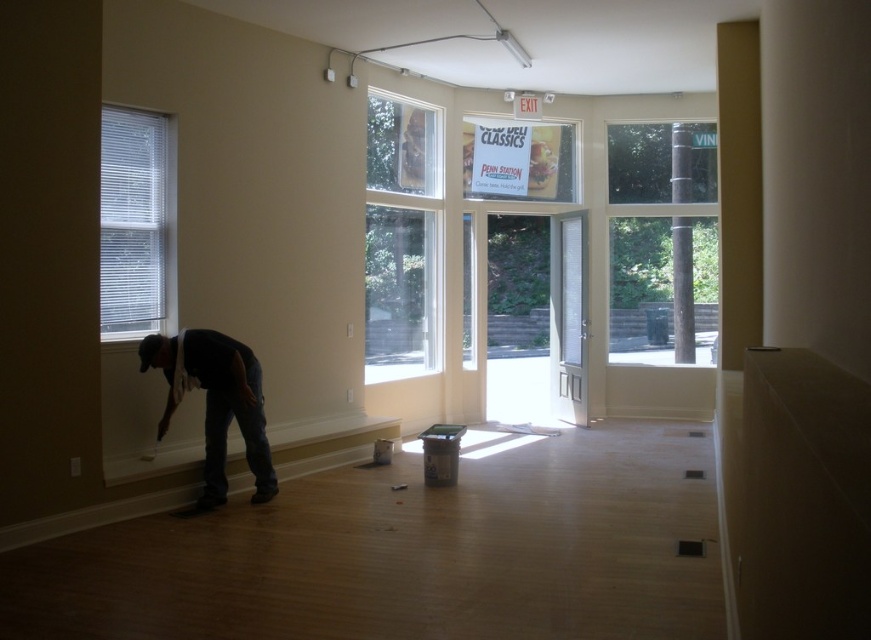
You are an interior designer who wants to install a new decorative sticker on the clear glass window at center and the white blinds at left. Since you want the stickers to be proportional to the objects, which object should you choose a larger sticker for?

The clear glass window at center is bigger than the white blinds at left, so you should choose a larger sticker for the clear glass window at center.

You are standing in the room and want to exit through the clear glass door at center. Is the clear glass window at center blocking your path to the door?

The clear glass window at center occupies less space than clear glass door at center, so it is smaller and likely positioned next to the door rather than in front of it. Therefore, the clear glass window at center is not blocking your path to the door.

You are standing inside the room and want to look outside through the clear glass window at center and the white blinds at left. Which object allows you to see the outside more clearly?

The clear glass window at center allows you to see the outside more clearly than the white blinds at left because it is made of transparent glass, while the white blinds at left may block or obscure the view.